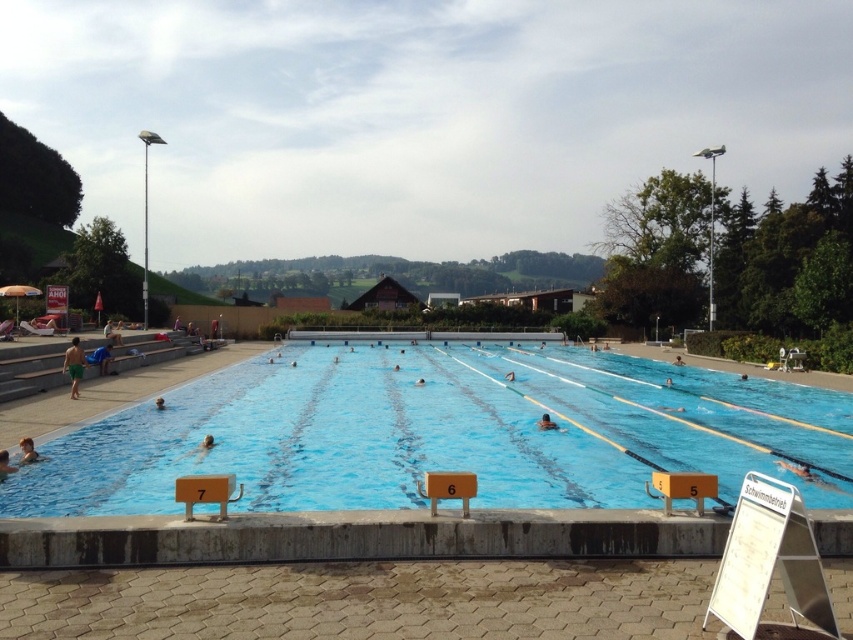
You are a photographer positioned at the edge of the pool. You want to capture a shot of both the brown hair at upper center and the smooth skin person at center in the same frame. Based on their positions, which direction should you move to ensure both subjects are visible?

Since the brown hair at upper center is to the left of the smooth skin person at center, you should move to the right to ensure both subjects are visible in the frame.

You are a photographer positioned at the edge of the pool. You want to capture a photo of the brown hair at upper center and the smooth skin person at center such that both are visible in the frame. Based on their positions, which object should be placed lower in the photo?

The brown hair at upper center is below the smooth skin person at center, so to include both in the frame, the brown hair at upper center should be placed lower in the photo.

You are a photographer positioned at the edge of the pool. You want to capture a photo that includes both the green matte shorts at left and the smooth skin person at center. Considering their sizes, which object should you focus on to ensure both are clearly visible in the frame?

The green matte shorts at left is larger in size than the smooth skin person at center, so focusing on the green matte shorts at left would help ensure both are clearly visible in the frame since it takes up more space.